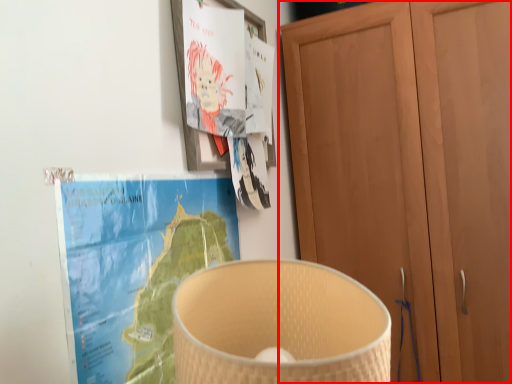
Question: In this image, where is cupboard (annotated by the red box) located relative to paperback book?

Choices:
 (A) right
 (B) left

Answer: (A)